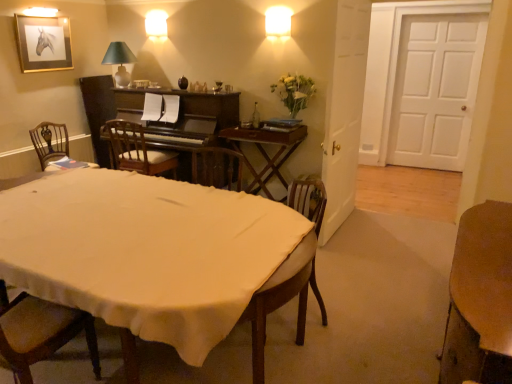
Question: Does gold-framed picture at upper left have a lesser height compared to green fabric lampshade at upper left, marked as the 2th lamp in a right-to-left arrangement?

Choices:
 (A) no
 (B) yes

Answer: (A)

Question: From a real-world perspective, is gold-framed picture at upper left physically below green fabric lampshade at upper left, placed as the 2th lamp when sorted from top to bottom?

Choices:
 (A) yes
 (B) no

Answer: (B)

Question: Is gold-framed picture at upper left behind green fabric lampshade at upper left, placed as the 2th lamp when sorted from top to bottom?

Choices:
 (A) no
 (B) yes

Answer: (A)

Question: From the image's perspective, is gold-framed picture at upper left located beneath green fabric lampshade at upper left, marked as the first lamp in a left-to-right arrangement?

Choices:
 (A) yes
 (B) no

Answer: (B)

Question: Considering the relative sizes of gold-framed picture at upper left and green fabric lampshade at upper left, positioned as the first lamp in bottom-to-top order, in the image provided, is gold-framed picture at upper left taller than green fabric lampshade at upper left, positioned as the first lamp in bottom-to-top order,?

Choices:
 (A) yes
 (B) no

Answer: (A)

Question: Is gold-framed picture at upper left thinner than green fabric lampshade at upper left, positioned as the first lamp in bottom-to-top order?

Choices:
 (A) yes
 (B) no

Answer: (A)

Question: Is wooden desk at center, arranged as the first table when viewed from the left, shorter than wooden table at lower right, the first table from the bottom?

Choices:
 (A) yes
 (B) no

Answer: (B)

Question: Considering the relative sizes of wooden desk at center, arranged as the first table when viewed from the left, and wooden table at lower right, acting as the 1th table starting from the front, in the image provided, is wooden desk at center, arranged as the first table when viewed from the left, bigger than wooden table at lower right, acting as the 1th table starting from the front,?

Choices:
 (A) no
 (B) yes

Answer: (A)

Question: Could you tell me if wooden desk at center, marked as the first table in a top-to-bottom arrangement, is turned towards wooden table at lower right, which ranks as the 2th table in top-to-bottom order?

Choices:
 (A) yes
 (B) no

Answer: (B)

Question: Considering the relative sizes of wooden desk at center, arranged as the first table when viewed from the left, and wooden table at lower right, which is counted as the second table, starting from the back, in the image provided, is wooden desk at center, arranged as the first table when viewed from the left, thinner than wooden table at lower right, which is counted as the second table, starting from the back,?

Choices:
 (A) yes
 (B) no

Answer: (B)

Question: From the image's perspective, is wooden desk at center, positioned as the 1th table in back-to-front order, under wooden table at lower right, which is counted as the second table, starting from the back?

Choices:
 (A) no
 (B) yes

Answer: (A)

Question: Is wooden table at lower right, which ranks as the 2th table in top-to-bottom order, located within wooden desk at center, marked as the first table in a top-to-bottom arrangement?

Choices:
 (A) no
 (B) yes

Answer: (A)

Question: Considering the relative sizes of green fabric lampshade at upper left, positioned as the first lamp in bottom-to-top order, and dark brown polished wood piano at center in the image provided, is green fabric lampshade at upper left, positioned as the first lamp in bottom-to-top order, thinner than dark brown polished wood piano at center?

Choices:
 (A) yes
 (B) no

Answer: (A)